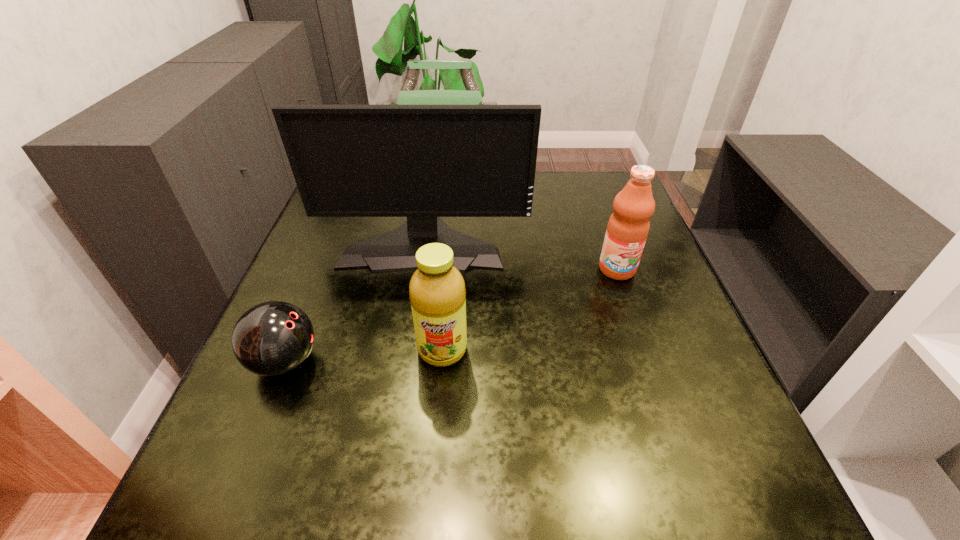
I want to click on vacant area in the image that satisfies the following two spatial constraints: 1. on the front label of the nearer fruit juice; 2. on the surface of the bowling ball near the finger holes, so click(x=442, y=362).

This screenshot has height=540, width=960. In order to click on blank area in the image that satisfies the following two spatial constraints: 1. on the screen side of the tallest object; 2. on the surface of the shortest object near the finger holes in this screenshot , I will do `click(405, 362)`.

Find the location of a particular element. free space that satisfies the following two spatial constraints: 1. on the screen side of the monitor; 2. on the surface of the bowling ball near the finger holes is located at coordinates (405, 362).